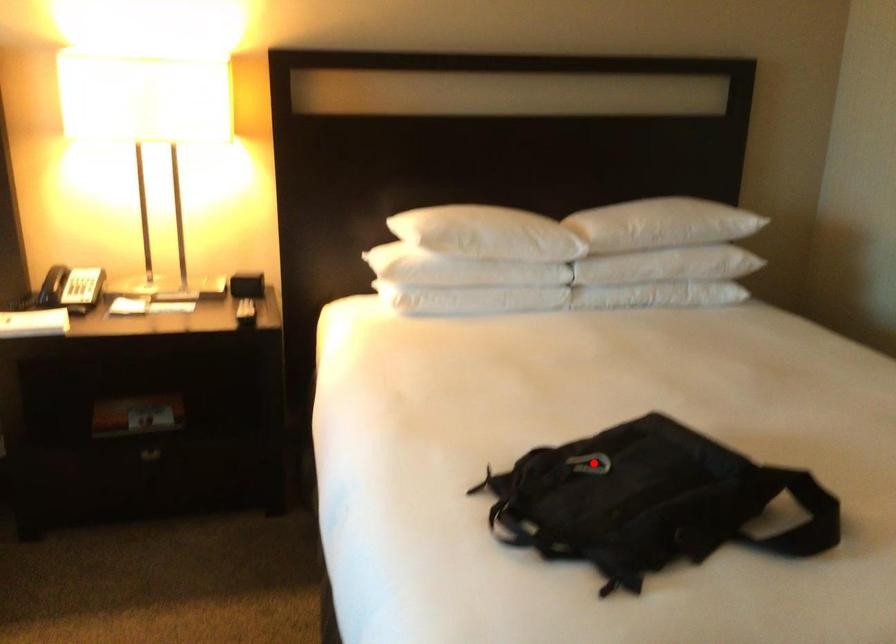
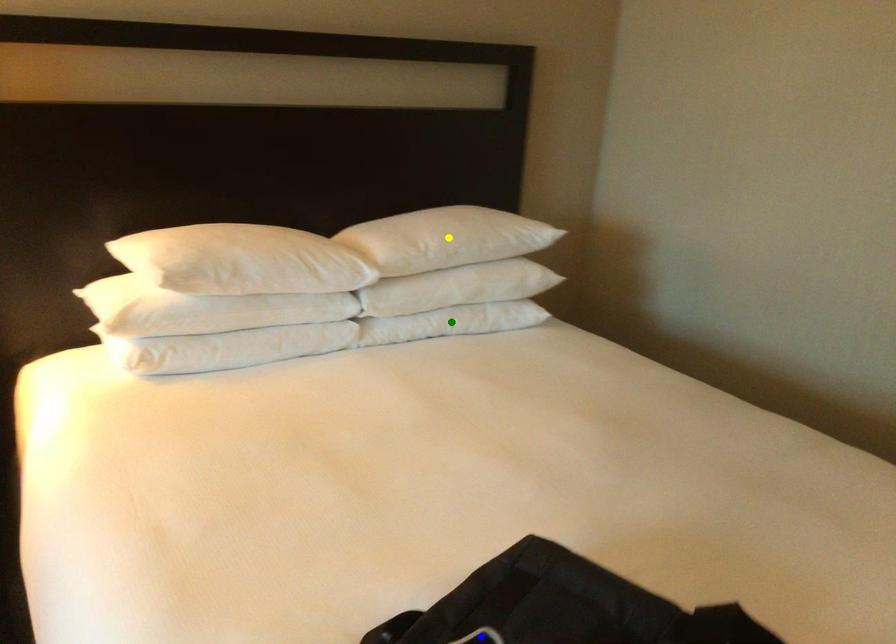
Question: I am providing you with two images of the same scene from different viewpoints. A red point is marked on the first image. You are given multiple points on the second image. Can you choose the point in image 2 that corresponds to the point in image 1?

Choices:
 (A) blue point
 (B) yellow point
 (C) green point

Answer: (A)